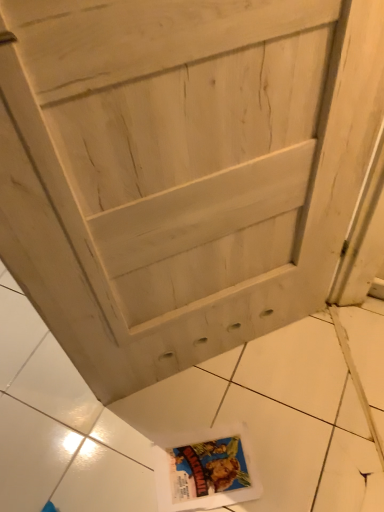
Identify the location of vacant area on top of matte paper book cover at lower center (from a real-world perspective). (206, 463).